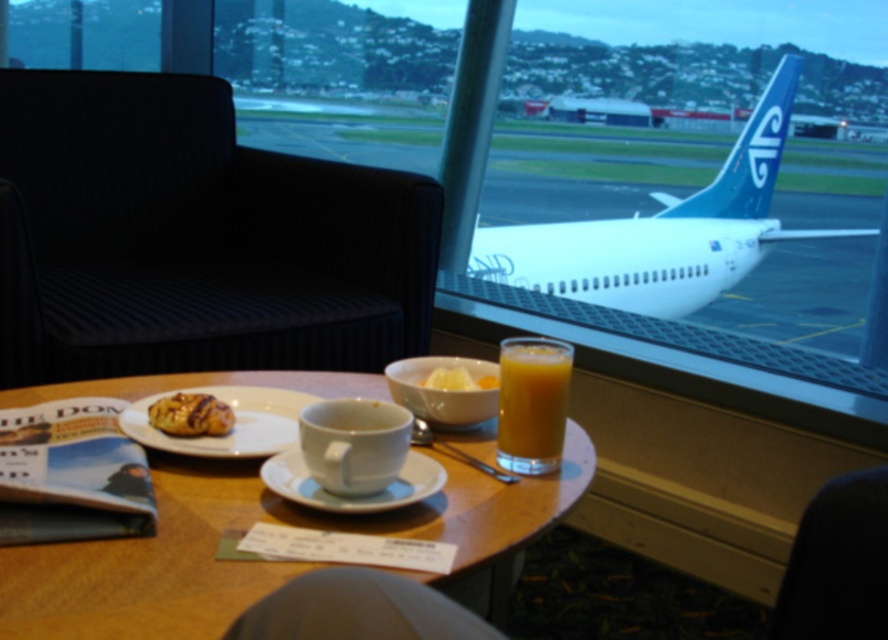
Question: Which point is farther to the camera?

Choices:
 (A) golden glazed pastry at center
 (B) white ceramic saucer at center
 (C) yellow creamy spread at center

Answer: (C)

Question: Does wooden table at center have a lesser width compared to white ceramic saucer at center?

Choices:
 (A) no
 (B) yes

Answer: (A)

Question: Which of these objects is positioned closest to the white glossy airplane at upper right?

Choices:
 (A) wooden table at center
 (B) black fabric armchair at left

Answer: (B)

Question: Can you confirm if white glossy airplane at upper right is wider than yellow creamy spread at center?

Choices:
 (A) yes
 (B) no

Answer: (A)

Question: Can you confirm if white glossy airplane at upper right is smaller than golden brown flaky pastry at lower left?

Choices:
 (A) yes
 (B) no

Answer: (B)

Question: Which point appears farthest from the camera in this image?

Choices:
 (A) (366, 205)
 (B) (777, 102)

Answer: (B)